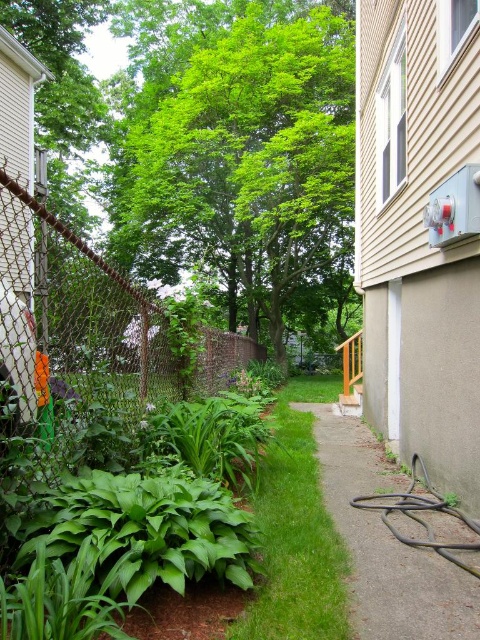
Question: Which object is closer to the camera taking this photo?

Choices:
 (A) green leafy grass at center
 (B) black rubber hose at lower right

Answer: (A)

Question: Is green leafy tree at center further to camera compared to black rubber hose at lower right?

Choices:
 (A) yes
 (B) no

Answer: (A)

Question: Does green leafy tree at center appear on the right side of black rubber hose at lower right?

Choices:
 (A) yes
 (B) no

Answer: (B)

Question: Based on their relative distances, which object is nearer to the green leafy tree at center?

Choices:
 (A) green leafy grass at center
 (B) rusty chain-link fence at left

Answer: (B)

Question: Does rusty chain-link fence at left come in front of green leafy grass at center?

Choices:
 (A) no
 (B) yes

Answer: (A)

Question: Which point is closer to the camera?

Choices:
 (A) (236, 637)
 (B) (49, 326)

Answer: (A)